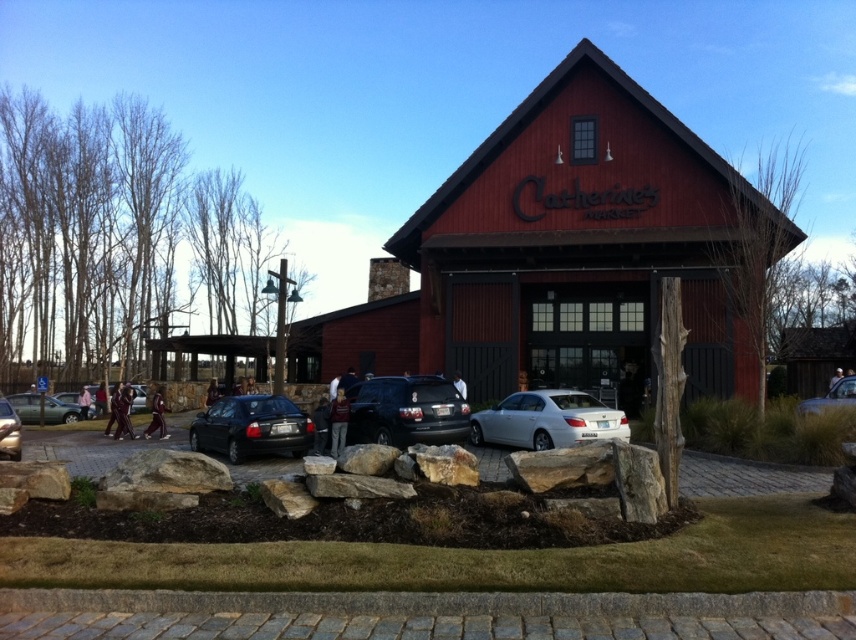
You are standing at the entrance of Catherine Market and want to park your matte black suv at center. The parking spot you want is at coordinate point 0.644, 0.475. Is your current position at the entrance the right spot to park?

The 2D location of matte black suv at center is at point (406, 412), so yes, the entrance is the correct spot to park your matte black suv at center.

You are a delivery driver needing to back your matte black suv at center into a parking spot behind the matte red barn at center. The parking spot requires a clearance of 35 feet. Can you safely back into the spot without hitting the barn?

The distance between the matte red barn at center and the matte black suv at center is 30.32 feet, which is less than the required 35 feet clearance. Therefore, you cannot safely back into the parking spot without risking a collision.

You are a customer arriving at Catherine Market and see both the matte black suv at center and the shiny black sedan at center parked in front of the building. Which vehicle is positioned more to the right side of the entrance?

The matte black suv at center is positioned more to the right side of the entrance than the shiny black sedan at center.